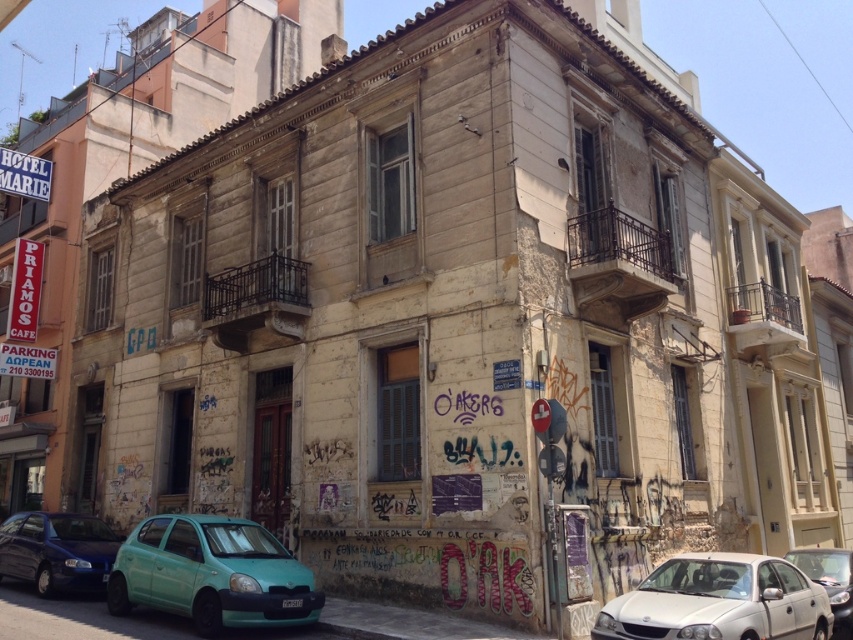
Measure the distance between teal matte hatchback at lower left and white matte sedan at lower right.

teal matte hatchback at lower left and white matte sedan at lower right are 5.30 meters apart from each other.

Does point (225, 579) lie in front of point (666, 621)?

That is False.

Where is `teal matte hatchback at lower left`? This screenshot has height=640, width=853. teal matte hatchback at lower left is located at coordinates (212, 573).

Is matte blue sedan at lower left closer to camera compared to metallic silver sedan at lower right?

No.

Which is more to the right, matte blue sedan at lower left or metallic silver sedan at lower right?

metallic silver sedan at lower right is more to the right.

Who is more distant from viewer, (78,536) or (846,618)?

The point (78,536) is more distant.

At what (x,y) coordinates should I click in order to perform the action: click on matte blue sedan at lower left. Please return your answer as a coordinate pair (x, y). This screenshot has width=853, height=640. Looking at the image, I should click on (57, 552).

Which of these two, teal matte hatchback at lower left or metallic silver sedan at lower right, stands taller?

Standing taller between the two is teal matte hatchback at lower left.

Does point (131, 580) lie behind point (821, 579)?

No, it is not.

Does point (227, 522) lie in front of point (840, 609)?

That is False.

Find the location of a particular element. Image resolution: width=853 pixels, height=640 pixels. teal matte hatchback at lower left is located at coordinates (212, 573).